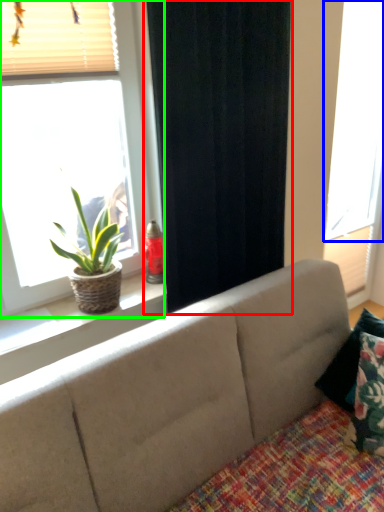
Question: Based on their relative distances, which object is nearer to curtain (highlighted by a red box)? Choose from window (highlighted by a blue box) and window (highlighted by a green box).

Choices:
 (A) window
 (B) window

Answer: (B)